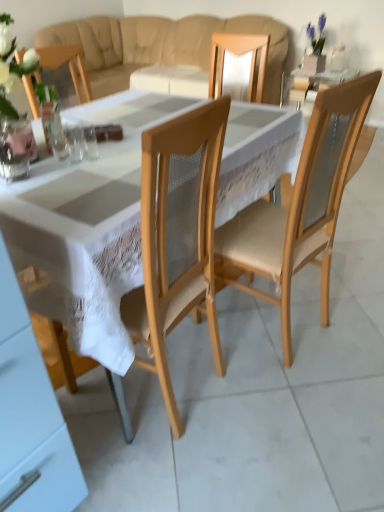
Identify the location of vacant space that is to the left of clear glass at center, which is counted as the third tableware, starting from the right. (29, 161).